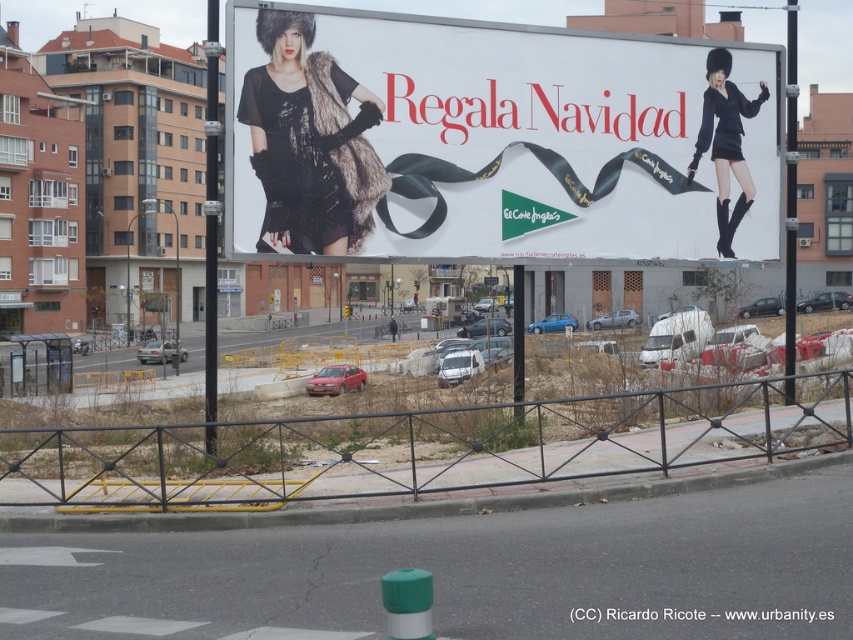
Between matte black dress at center and fur coat at upper center, which one is positioned lower?

matte black dress at center is below.

Who is more forward, (518, 102) or (265, 182)?

Point (265, 182) is more forward.

Locate an element on the screen. This screenshot has height=640, width=853. matte black dress at center is located at coordinates (489, 140).

Who is more forward, [302,435] or [740,173]?

Point [740,173] is more forward.

Does black metal fence at lower center appear on the right side of matte black fur coat at right?

Incorrect, black metal fence at lower center is not on the right side of matte black fur coat at right.

The image size is (853, 640). I want to click on black metal fence at lower center, so click(419, 448).

This screenshot has height=640, width=853. Find the location of `black metal fence at lower center`. black metal fence at lower center is located at coordinates (419, 448).

Between fur coat at upper center and matte black fur coat at right, which one has more height?

fur coat at upper center

Which is more to the left, fur coat at upper center or matte black fur coat at right?

fur coat at upper center

This screenshot has width=853, height=640. Describe the element at coordinates (309, 141) in the screenshot. I see `fur coat at upper center` at that location.

The image size is (853, 640). Find the location of `fur coat at upper center`. fur coat at upper center is located at coordinates (309, 141).